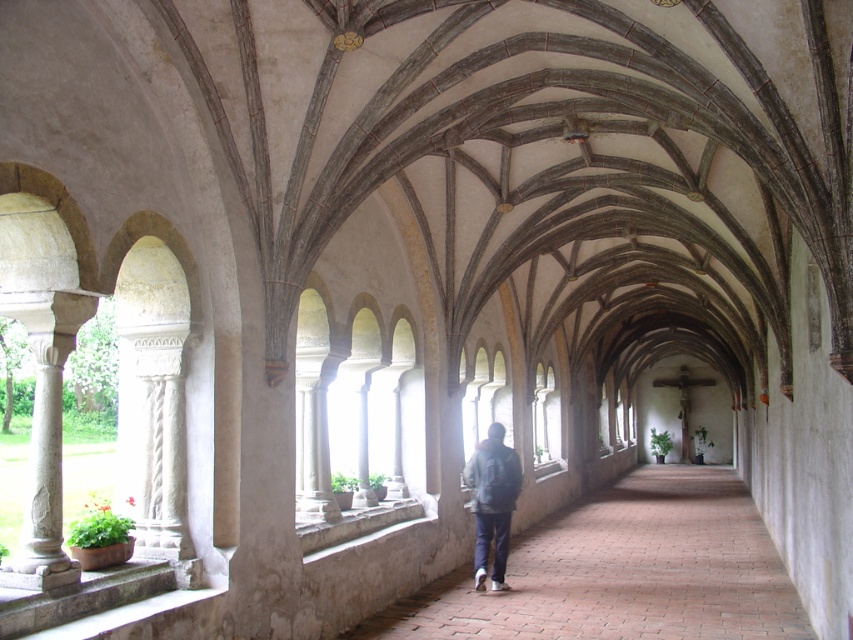
Between point (714, 624) and point (486, 444), which one is positioned in front?

Point (714, 624)

Who is more distant from viewer, [585,637] or [502,570]?

Positioned behind is point [502,570].

You are a GUI agent. You are given a task and a screenshot of the screen. Output one action in this format:
    pyautogui.click(x=<x>, y=<y>)
    Task: Click on the brown brick path at center
    This screenshot has height=640, width=853.
    Given the screenshot: What is the action you would take?
    coord(622,572)